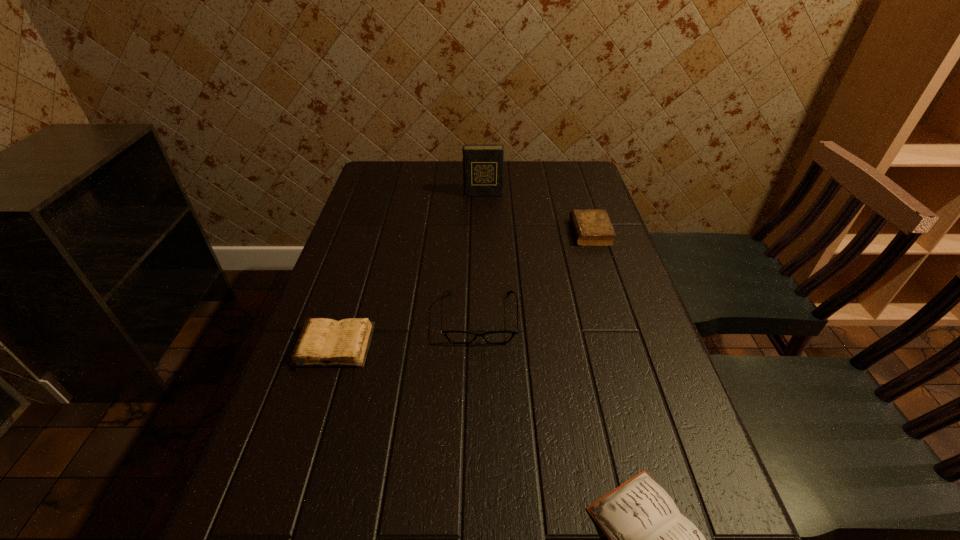
In the image, there is a desktop. In order to click on vacant space at the far right corner in this screenshot , I will do [x=558, y=161].

At what (x,y) coordinates should I click in order to perform the action: click on vacant region between the farthest diary and the third farthest diary. Please return your answer as a coordinate pair (x, y). The height and width of the screenshot is (540, 960). Looking at the image, I should click on (409, 270).

Identify the location of blank region between the second shortest object and the third diary from right to left. point(409,270).

You are a GUI agent. You are given a task and a screenshot of the screen. Output one action in this format:
    pyautogui.click(x=<x>, y=<y>)
    Task: Click on the vacant space that's between the second tallest object and the third shortest object
    The image size is (960, 540).
    Given the screenshot: What is the action you would take?
    pyautogui.click(x=535, y=275)

Locate an element on the screen. The image size is (960, 540). vacant region between the spectacles and the farthest diary is located at coordinates (481, 256).

Locate an element on the screen. The width and height of the screenshot is (960, 540). object that ranks as the second closest to the second shortest object is located at coordinates (649, 539).

You are a GUI agent. You are given a task and a screenshot of the screen. Output one action in this format:
    pyautogui.click(x=<x>, y=<y>)
    Task: Click on the object that ranks as the second closest to the spectacles
    The width and height of the screenshot is (960, 540).
    Given the screenshot: What is the action you would take?
    pyautogui.click(x=592, y=227)

You are a GUI agent. You are given a task and a screenshot of the screen. Output one action in this format:
    pyautogui.click(x=<x>, y=<y>)
    Task: Click on the diary that can be found as the closest to the third diary from right to left
    The height and width of the screenshot is (540, 960).
    Given the screenshot: What is the action you would take?
    pyautogui.click(x=592, y=227)

The height and width of the screenshot is (540, 960). Identify the location of the closest diary to the second farthest object. (482, 164).

The width and height of the screenshot is (960, 540). I want to click on free spot that satisfies the following two spatial constraints: 1. on the spine side of the third shortest object; 2. on the front side of the second shortest diary, so click(627, 346).